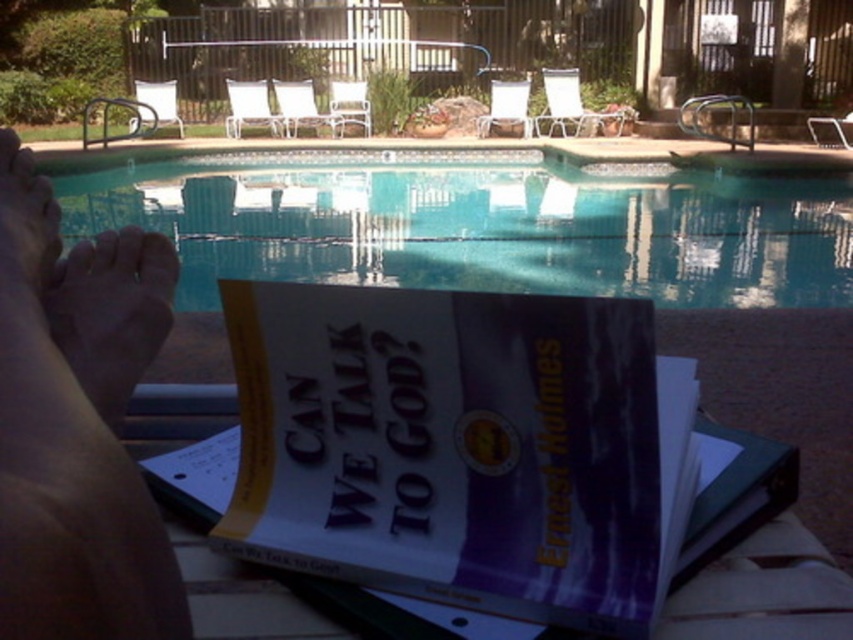
Based on the photo, you are a person who wants to read the book titled Can We Talk To God? by Ernest Holmes. The book is located at the center of the image. There is a point marked at coordinates (451, 445). Can you determine if the book is near the marked point?

The point (451, 445) marks the purple paper book at center, so yes, the book is exactly at the marked point.